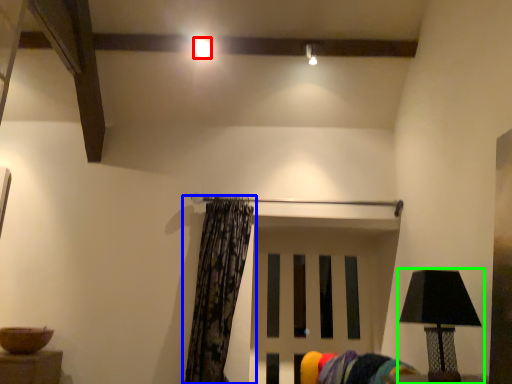
Question: Which object is the farthest from lighting (highlighted by a red box)? Choose among these: curtain (highlighted by a blue box) or lamp (highlighted by a green box).

Choices:
 (A) curtain
 (B) lamp

Answer: (B)